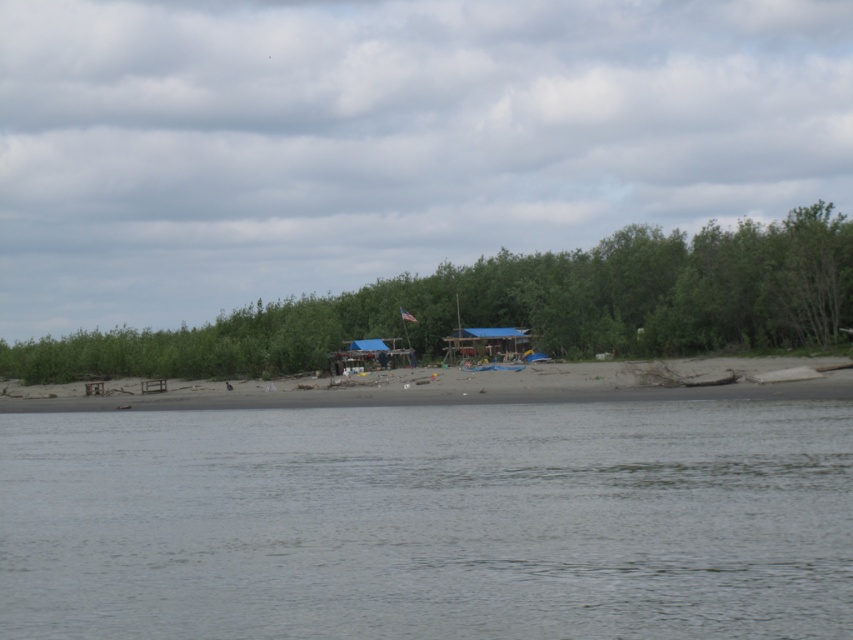
You are standing at the point with coordinates point [712,385] and want to walk towards the point with coordinates point [786,328]. Which direction should you face to move towards it?

To move from point [712,385] to point [786,328], you should face towards the northwest direction because point [786,328] is located behind point [712,385].

You are planning to set up a tent for a camping trip. You have two options for locations on the beige sand beach at center and under the green leafy trees at center. Which location would provide more privacy from the river view?

The green leafy trees at center would provide more privacy from the river view because they are taller than the beige sand beach at center, which is lower and more exposed.

You are a photographer planning to set up a tripod on the beige sand beach at center. You need to ensure that the gray water at center won

The gray water at center is not as tall as the beige sand beach at center, so the tripod placed on the beige sand beach at center will be higher than the gray water at center. This means the tripod will remain stable and not submerged by the water.